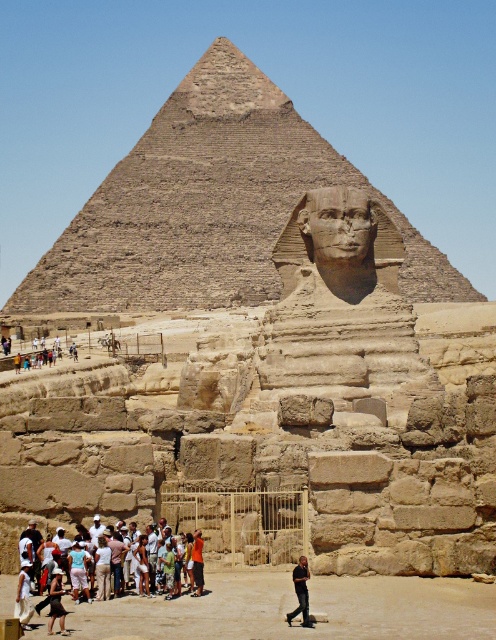
Question: Which object is closer to the camera taking this photo?

Choices:
 (A) white cotton shirt at lower left
 (B) dark brown leather pants at lower center

Answer: (A)

Question: Can you confirm if white cotton shirt at lower left is positioned to the right of dark brown leather pants at lower center?

Choices:
 (A) no
 (B) yes

Answer: (A)

Question: Which object is positioned farthest from the dark brown leather pants at lower center?

Choices:
 (A) brown stone pyramid at center
 (B) white cotton shirt at lower left

Answer: (A)

Question: Which object appears closest to the camera in this image?

Choices:
 (A) dark brown leather pants at lower center
 (B) white cotton shirt at lower left

Answer: (B)

Question: From the image, what is the correct spatial relationship of white cotton shirt at lower left in relation to dark brown leather pants at lower center?

Choices:
 (A) right
 (B) left

Answer: (B)

Question: In this image, where is white cotton shirt at lower left located relative to dark brown leather pants at lower center?

Choices:
 (A) above
 (B) below

Answer: (B)